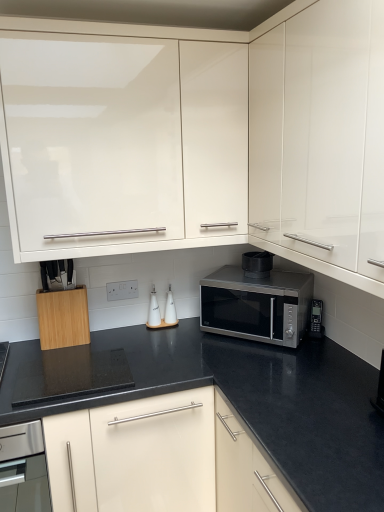
The height and width of the screenshot is (512, 384). What do you see at coordinates (170, 309) in the screenshot? I see `white ceramic oil bottles at center, the third appliance positioned from the right` at bounding box center [170, 309].

This screenshot has width=384, height=512. Describe the element at coordinates (153, 310) in the screenshot. I see `white glossy salt shaker at center, arranged as the 4th appliance when viewed from the right` at that location.

In order to click on glossy white cabinet at center, the first cabinetry positioned from the right in this screenshot , I will do `click(321, 137)`.

Measure the distance between point [300,333] and camera.

The depth of point [300,333] is 1.81 meters.

What do you see at coordinates (257, 305) in the screenshot? I see `satin silver microwave at center` at bounding box center [257, 305].

What do you see at coordinates (316, 320) in the screenshot? The width and height of the screenshot is (384, 512). I see `black plastic phone at lower right, the fourth appliance from the left` at bounding box center [316, 320].

Locate an element on the screen. This screenshot has width=384, height=512. white ceramic oil bottles at center, the 2th appliance from the left is located at coordinates (170, 309).

Is glossy white cabinet at upper left, which is the 2th cabinetry in right-to-left order, bigger or smaller than black matte microwave at center, the 2th appliance from the right?

Considering their sizes, glossy white cabinet at upper left, which is the 2th cabinetry in right-to-left order, takes up more space than black matte microwave at center, the 2th appliance from the right.

Can you see glossy white cabinet at upper left, which is the 2th cabinetry in left-to-right order, touching black matte microwave at center, the 3th appliance viewed from the left?

glossy white cabinet at upper left, which is the 2th cabinetry in left-to-right order, and black matte microwave at center, the 3th appliance viewed from the left, are clearly separated.

Which object is thinner, glossy white cabinet at upper left, which is the 2th cabinetry in left-to-right order, or black matte microwave at center, the 2th appliance from the right?

With smaller width is black matte microwave at center, the 2th appliance from the right.

From the image's perspective, relative to black matte microwave at center, the 3th appliance viewed from the left, is glossy white cabinet at upper left, which is the 2th cabinetry in right-to-left order, above or below?

Based on their image positions, glossy white cabinet at upper left, which is the 2th cabinetry in right-to-left order, is located above black matte microwave at center, the 3th appliance viewed from the left.

Is white ceramic oil bottles at center, the third appliance positioned from the right, inside white glossy salt shaker at center, the 1th appliance viewed from the left?

No, white ceramic oil bottles at center, the third appliance positioned from the right, is not inside white glossy salt shaker at center, the 1th appliance viewed from the left.

Is white glossy salt shaker at center, arranged as the 4th appliance when viewed from the right, bigger than white ceramic oil bottles at center, the 2th appliance from the left?

Incorrect, white glossy salt shaker at center, arranged as the 4th appliance when viewed from the right, is not larger than white ceramic oil bottles at center, the 2th appliance from the left.

From a real-world perspective, is white glossy salt shaker at center, the 1th appliance viewed from the left, below white ceramic oil bottles at center, the third appliance positioned from the right?

Actually, white glossy salt shaker at center, the 1th appliance viewed from the left, is physically above white ceramic oil bottles at center, the third appliance positioned from the right, in the real world.

From the image's perspective, is white glossy salt shaker at center, the 1th appliance viewed from the left, under white ceramic oil bottles at center, the 2th appliance from the left?

Yes, from the image's perspective, white glossy salt shaker at center, the 1th appliance viewed from the left, is beneath white ceramic oil bottles at center, the 2th appliance from the left.

From the picture: Is glossy white cabinet at upper left, which is the 2th cabinetry in right-to-left order, oriented away from white glossy salt shaker at center, arranged as the 4th appliance when viewed from the right?

glossy white cabinet at upper left, which is the 2th cabinetry in right-to-left order, is not turned away from white glossy salt shaker at center, arranged as the 4th appliance when viewed from the right.

From the glossy white cabinet at upper left, which is the 2th cabinetry in right-to-left order, count 1st appliance to the right and point to it. Please provide its 2D coordinates.

[(153, 310)]

Is point (158, 185) positioned behind point (156, 318)?

No.

Consider the image. Who is shorter, glossy white cabinet at upper left, which is the 2th cabinetry in left-to-right order, or white glossy salt shaker at center, the 1th appliance viewed from the left?

white glossy salt shaker at center, the 1th appliance viewed from the left.

In the scene shown: How many degrees apart are the facing directions of white glossy salt shaker at center, arranged as the 4th appliance when viewed from the right, and glossy white cabinet at upper left, which is the 2th cabinetry in right-to-left order?

The angular difference between white glossy salt shaker at center, arranged as the 4th appliance when viewed from the right, and glossy white cabinet at upper left, which is the 2th cabinetry in right-to-left order, is 0.996 degrees.

Would you consider white glossy salt shaker at center, arranged as the 4th appliance when viewed from the right, to be distant from glossy white cabinet at upper left, which is the 2th cabinetry in right-to-left order?

No, white glossy salt shaker at center, arranged as the 4th appliance when viewed from the right, is not far away from glossy white cabinet at upper left, which is the 2th cabinetry in right-to-left order.

Is white glossy salt shaker at center, the 1th appliance viewed from the left, inside or outside of glossy white cabinet at upper left, which is the 2th cabinetry in right-to-left order?

The correct answer is: outside.

Where is `the 2nd cabinetry in front when counting from the white glossy salt shaker at center, the 1th appliance viewed from the left`? This screenshot has height=512, width=384. the 2nd cabinetry in front when counting from the white glossy salt shaker at center, the 1th appliance viewed from the left is located at coordinates (90, 141).

Considering the sizes of objects satin silver microwave at center and white plastic electric outlet at center in the image provided, who is wider, satin silver microwave at center or white plastic electric outlet at center?

With larger width is satin silver microwave at center.

Are satin silver microwave at center and white plastic electric outlet at center beside each other?

No, satin silver microwave at center is not in contact with white plastic electric outlet at center.

Does satin silver microwave at center turn towards white plastic electric outlet at center?

No, satin silver microwave at center is not oriented towards white plastic electric outlet at center.

Is black matte microwave at center, the 2th appliance from the right, to the left or to the right of white plastic electric outlet at center in the image?

From the image, it's evident that black matte microwave at center, the 2th appliance from the right, is to the right of white plastic electric outlet at center.

Which is behind, point (260, 270) or point (123, 282)?

Positioned behind is point (123, 282).

Between black matte microwave at center, the 2th appliance from the right, and white plastic electric outlet at center, which one is positioned behind?

white plastic electric outlet at center is behind.

Is black matte microwave at center, the 3th appliance viewed from the left, oriented towards white plastic electric outlet at center?

No.

Can you tell me how much white plastic electric outlet at center and glossy white cabinet at center, marked as the third cabinetry in a left-to-right arrangement, differ in facing direction?

The facing directions of white plastic electric outlet at center and glossy white cabinet at center, marked as the third cabinetry in a left-to-right arrangement, are 95 degrees apart.

Considering the positions of objects white plastic electric outlet at center and glossy white cabinet at center, the first cabinetry positioned from the right, in the image provided, who is in front, white plastic electric outlet at center or glossy white cabinet at center, the first cabinetry positioned from the right,?

Positioned in front is glossy white cabinet at center, the first cabinetry positioned from the right.

Find the location of a particular element. This screenshot has height=512, width=384. electric outlet located behind the glossy white cabinet at center, marked as the third cabinetry in a left-to-right arrangement is located at coordinates (122, 290).

Identify the location of the 2nd cabinetry in front of the black matte microwave at center, the 2th appliance from the right. The width and height of the screenshot is (384, 512). (90, 141).

From the image's perspective, which appliance is the 1st one below the white ceramic oil bottles at center, the 2th appliance from the left? Please provide its 2D coordinates.

[(153, 310)]

Based on their spatial positions, is glossy white cabinet at upper left, which is the 2th cabinetry in left-to-right order, or satin silver microwave at center closer to white glossy salt shaker at center, the 1th appliance viewed from the left?

satin silver microwave at center is positioned closer to the anchor white glossy salt shaker at center, the 1th appliance viewed from the left.

Estimate the real-world distances between objects in this image. Which object is closer to black matte microwave at center, the 2th appliance from the right, glossy white cabinet at center, marked as the third cabinetry in a left-to-right arrangement, or white ceramic oil bottles at center, the 2th appliance from the left?

white ceramic oil bottles at center, the 2th appliance from the left.

From the image, which object appears to be nearer to white plastic electric outlet at center, white glossy salt shaker at center, arranged as the 4th appliance when viewed from the right, or glossy white cabinet at upper left, which is the 2th cabinetry in left-to-right order?

white glossy salt shaker at center, arranged as the 4th appliance when viewed from the right.

Looking at the image, which one is located further to white glossy salt shaker at center, arranged as the 4th appliance when viewed from the right, glossy white cabinet at center, marked as the third cabinetry in a left-to-right arrangement, or satin silver microwave at center?

Among the two, glossy white cabinet at center, marked as the third cabinetry in a left-to-right arrangement, is located further to white glossy salt shaker at center, arranged as the 4th appliance when viewed from the right.

Consider the image. When comparing their distances from white ceramic oil bottles at center, the 2th appliance from the left, does beech wood knife block at lower left, positioned as the third cabinetry in right-to-left order, or white glossy salt shaker at center, arranged as the 4th appliance when viewed from the right, seem further?

beech wood knife block at lower left, positioned as the third cabinetry in right-to-left order, is positioned further to the anchor white ceramic oil bottles at center, the 2th appliance from the left.

Consider the image. Considering their positions, is white plastic electric outlet at center positioned further to white ceramic oil bottles at center, the third appliance positioned from the right, than white glossy salt shaker at center, arranged as the 4th appliance when viewed from the right?

The object further to white ceramic oil bottles at center, the third appliance positioned from the right, is white plastic electric outlet at center.

Looking at the image, which one is located further to white ceramic oil bottles at center, the 2th appliance from the left, glossy white cabinet at upper left, which is the 2th cabinetry in left-to-right order, or white glossy salt shaker at center, arranged as the 4th appliance when viewed from the right?

Based on the image, glossy white cabinet at upper left, which is the 2th cabinetry in left-to-right order, appears to be further to white ceramic oil bottles at center, the 2th appliance from the left.

Based on their spatial positions, is glossy white cabinet at center, the first cabinetry positioned from the right, or satin silver microwave at center further from black plastic phone at lower right, the 1th appliance from the right?

glossy white cabinet at center, the first cabinetry positioned from the right.

Where is `microwave oven between glossy white cabinet at upper left, which is the 2th cabinetry in right-to-left order, and black plastic phone at lower right, the 1th appliance from the right, in the horizontal direction`? microwave oven between glossy white cabinet at upper left, which is the 2th cabinetry in right-to-left order, and black plastic phone at lower right, the 1th appliance from the right, in the horizontal direction is located at coordinates (257, 305).

You are a GUI agent. You are given a task and a screenshot of the screen. Output one action in this format:
    pyautogui.click(x=<x>, y=<y>)
    Task: Click on the electric outlet positioned between glossy white cabinet at center, the first cabinetry positioned from the right, and white ceramic oil bottles at center, the 2th appliance from the left, from near to far
    This screenshot has height=512, width=384.
    Given the screenshot: What is the action you would take?
    pyautogui.click(x=122, y=290)

Where is `microwave oven positioned between glossy white cabinet at center, marked as the third cabinetry in a left-to-right arrangement, and white ceramic oil bottles at center, the third appliance positioned from the right, from near to far`? The image size is (384, 512). microwave oven positioned between glossy white cabinet at center, marked as the third cabinetry in a left-to-right arrangement, and white ceramic oil bottles at center, the third appliance positioned from the right, from near to far is located at coordinates (257, 305).

The width and height of the screenshot is (384, 512). In order to click on appliance situated between beech wood knife block at lower left, positioned as the third cabinetry in right-to-left order, and white ceramic oil bottles at center, the third appliance positioned from the right, from left to right in this screenshot , I will do `click(153, 310)`.